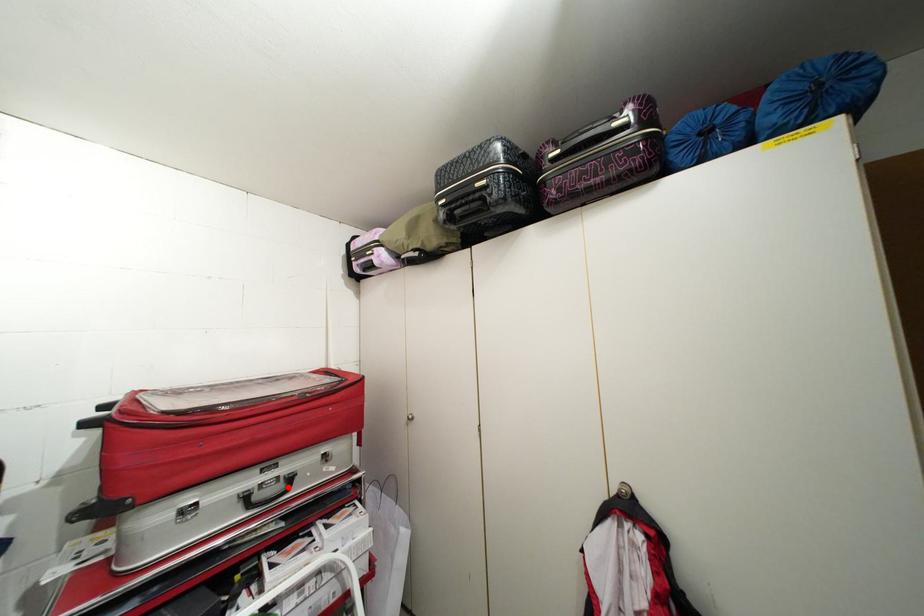
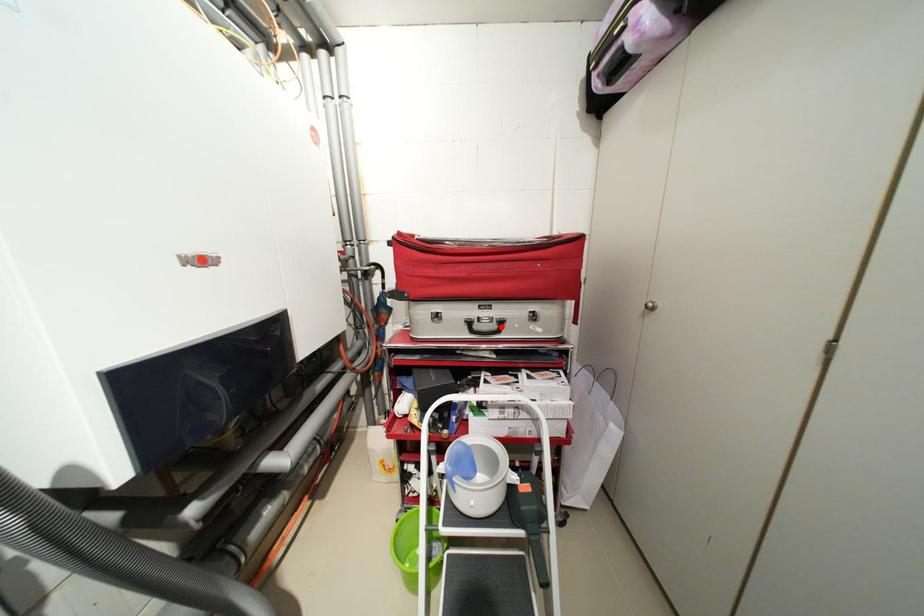
I am providing you with two images of the same scene from different viewpoints. A red point is marked on the first image and another point is marked on the second image. Is the marked point in image1 the same physical position as the marked point in image2?

Yes